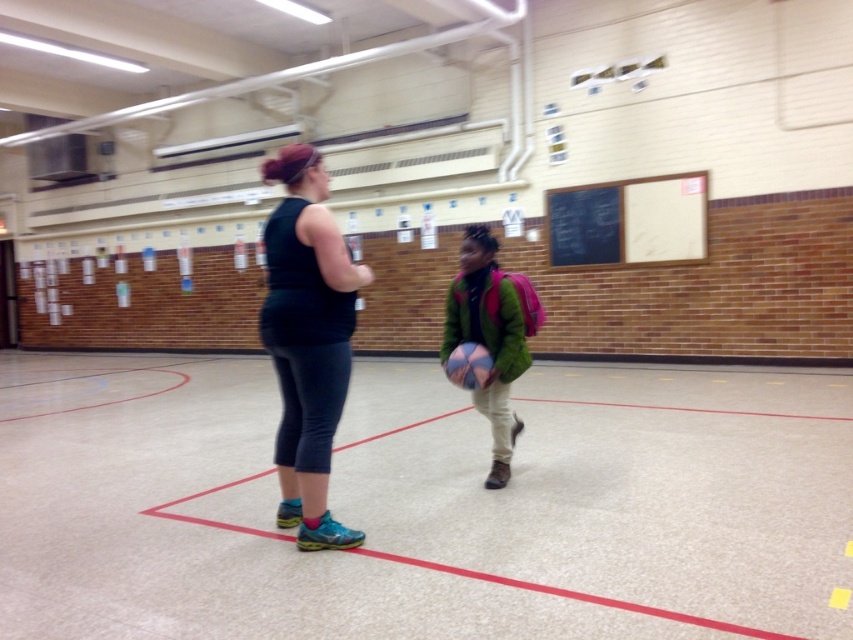
You are designing a new storage locker for the gymnasium that needs to accommodate both the black matte leggings at center and the green fuzzy jacket at center. Based on their sizes, which item requires more horizontal space when stored side by side?

The black matte leggings at center requires more horizontal space because its width is larger than the green fuzzy jacket at center.

You are standing in the gymnasium and need to place a new poster on the wall. The poster must be placed above the green fuzzy jacket at center. Where should you position the poster relative to the jacket?

The poster should be placed above the green fuzzy jacket at center since the jacket is located at point (492, 336), and the poster needs to be positioned higher on the wall.

You are a visitor entering the gymnasium and see the black chalkboard at upper right and the green fuzzy jacket at center. Which object is closer to the entrance?

The green fuzzy jacket at center is behind the black chalkboard at upper right, so the black chalkboard at upper right is closer to the entrance.